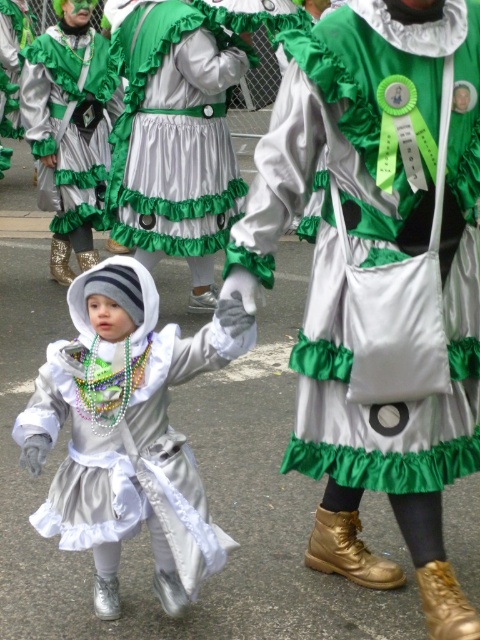
You are a photographer at the parade and want to capture a closeup of both the satin green purse at center and the satin silver dress at center. Given that your camera can only focus on one object at a time, which object should you adjust the focus to first if you want to ensure the wider object is in focus?

The satin green purse at center is wider than the satin silver dress at center. Therefore, you should first focus on the satin green purse at center to ensure the wider object is in focus.

You are a photographer at the parade and want to capture a photo of both the satin silver dress at center and the green satin dress at center. From the perspective of the photographer, which dress should you focus on first to ensure both are in the frame?

The photographer should focus on the green satin dress at center first since the satin silver dress at center is positioned to its right, ensuring both are included in the frame.